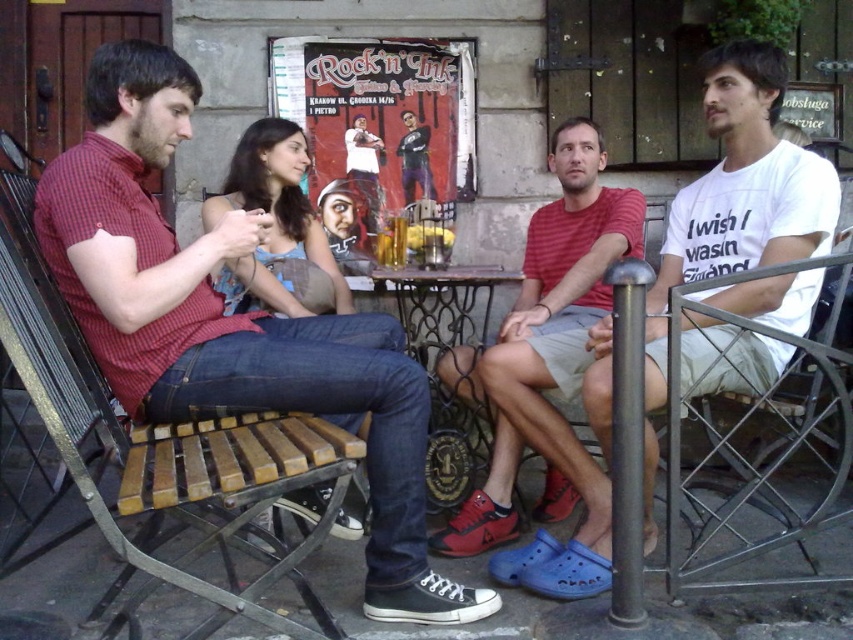
You are trying to decide where to sit in the outdoor area. There is a metallic wire chair at right and a red striped shirt at center. Which object is shorter?

The metallic wire chair at right is shorter than the red striped shirt at center.

You are standing at the center of the scene and want to move to the metallic wire chair at right. Which direction should you move to reach it?

Since the metallic wire chair at right is located at point 0.734 on the x axis and 0.886 on the y axis, you should move towards the right and slightly upwards to reach it.